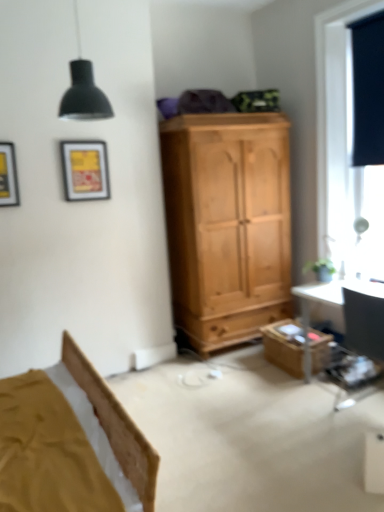
This screenshot has height=512, width=384. What are the coordinates of `matte yellow picture frame at upper left, which ranks as the second picture frame in back-to-front order` in the screenshot? It's located at (8, 176).

This screenshot has height=512, width=384. Describe the element at coordinates (8, 176) in the screenshot. I see `matte yellow picture frame at upper left, which is the first picture frame from front to back` at that location.

The image size is (384, 512). What do you see at coordinates (83, 89) in the screenshot?
I see `black matte lampshade at upper left` at bounding box center [83, 89].

Find the location of a particular element. black matte lampshade at upper left is located at coordinates (83, 89).

Describe the element at coordinates (284, 346) in the screenshot. The height and width of the screenshot is (512, 384). I see `wooden box at lower right` at that location.

Describe the element at coordinates (368, 90) in the screenshot. This screenshot has height=512, width=384. I see `black matte curtain at upper right` at that location.

Identify the location of matte yellow picture frame at upper left, which is counted as the first picture frame, starting from the left. The height and width of the screenshot is (512, 384). (8, 176).

This screenshot has height=512, width=384. Identify the location of curtain behind the matte yellow picture frame at upper left, which ranks as the second picture frame in back-to-front order. (368, 90).

Which of these two, black matte curtain at upper right or matte yellow picture frame at upper left, which is the first picture frame from front to back, is smaller?

matte yellow picture frame at upper left, which is the first picture frame from front to back, is smaller.

How many degrees apart are the facing directions of black matte curtain at upper right and matte yellow picture frame at upper left, which ranks as the second picture frame in back-to-front order?

The facing directions of black matte curtain at upper right and matte yellow picture frame at upper left, which ranks as the second picture frame in back-to-front order, are 94.1 degrees apart.

In the image, is black matte curtain at upper right on the left side or the right side of matte yellow picture frame at upper left, arranged as the second picture frame when viewed from the right?

In the image, black matte curtain at upper right appears on the right side of matte yellow picture frame at upper left, arranged as the second picture frame when viewed from the right.

Is wooden box at lower right outside of black matte lampshade at upper left?

Yes, wooden box at lower right is outside of black matte lampshade at upper left.

From the image's perspective, which is above, wooden box at lower right or black matte lampshade at upper left?

black matte lampshade at upper left is shown above in the image.

Could you tell me if wooden box at lower right is turned towards black matte lampshade at upper left?

No, wooden box at lower right is not turned towards black matte lampshade at upper left.

Is wooden box at lower right closer to camera compared to black matte lampshade at upper left?

No, it is behind black matte lampshade at upper left.

Can we say black matte curtain at upper right lies outside black fabric window at right?

That's incorrect, black matte curtain at upper right is not completely outside black fabric window at right.

Considering the relative positions of black matte curtain at upper right and black fabric window at right in the image provided, is black matte curtain at upper right to the left or to the right of black fabric window at right?

From the image, it's evident that black matte curtain at upper right is to the right of black fabric window at right.

Is black matte curtain at upper right aimed at black fabric window at right?

Yes, black matte curtain at upper right is oriented towards black fabric window at right.

From a real-world perspective, is black matte curtain at upper right over black fabric window at right?

Correct, in the physical world, black matte curtain at upper right is higher than black fabric window at right.

From a real-world perspective, between black fabric window at right and black matte lampshade at upper left, who is vertically higher?

black matte lampshade at upper left, from a real-world perspective.

You are a GUI agent. You are given a task and a screenshot of the screen. Output one action in this format:
    pyautogui.click(x=<x>, y=<y>)
    Task: Click on the light fixture above the black fabric window at right (from a real-world perspective)
    
    Given the screenshot: What is the action you would take?
    pyautogui.click(x=83, y=89)

Can you confirm if black fabric window at right is bigger than black matte lampshade at upper left?

Yes, black fabric window at right is bigger than black matte lampshade at upper left.

Can you confirm if matte yellow picture frame at upper left, which ranks as the second picture frame in back-to-front order, is positioned to the left of black matte curtain at upper right?

Yes.

From a real-world perspective, is matte yellow picture frame at upper left, which is counted as the first picture frame, starting from the left, positioned above or below black matte curtain at upper right?

matte yellow picture frame at upper left, which is counted as the first picture frame, starting from the left, is below black matte curtain at upper right.

Considering the relative sizes of matte yellow picture frame at upper left, which is counted as the first picture frame, starting from the left, and black matte curtain at upper right in the image provided, is matte yellow picture frame at upper left, which is counted as the first picture frame, starting from the left, smaller than black matte curtain at upper right?

Yes, matte yellow picture frame at upper left, which is counted as the first picture frame, starting from the left, is smaller than black matte curtain at upper right.

Between black matte curtain at upper right and black matte lampshade at upper left, which one has less height?

black matte lampshade at upper left.

Is black matte curtain at upper right next to black matte lampshade at upper left and touching it?

No, black matte curtain at upper right is not touching black matte lampshade at upper left.

Is black matte curtain at upper right in front of or behind black matte lampshade at upper left in the image?

black matte curtain at upper right is behind black matte lampshade at upper left.

Does point (364, 103) appear closer or farther from the camera than point (76, 65)?

Point (364, 103) is positioned farther from the camera compared to point (76, 65).

Is matte yellow picture frame at upper left, the 1th picture frame viewed from the back, located outside matte yellow picture frame at upper left, which is the first picture frame from front to back?

That's correct, matte yellow picture frame at upper left, the 1th picture frame viewed from the back, is outside of matte yellow picture frame at upper left, which is the first picture frame from front to back.

Between matte yellow picture frame at upper left, the second picture frame when ordered from left to right, and matte yellow picture frame at upper left, which is the first picture frame from front to back, which one has smaller width?

matte yellow picture frame at upper left, which is the first picture frame from front to back.

Considering their positions, is matte yellow picture frame at upper left, placed as the 1th picture frame when sorted from right to left, located in front of or behind matte yellow picture frame at upper left, arranged as the second picture frame when viewed from the right?

Clearly, matte yellow picture frame at upper left, placed as the 1th picture frame when sorted from right to left, is behind matte yellow picture frame at upper left, arranged as the second picture frame when viewed from the right.

The width and height of the screenshot is (384, 512). I want to click on picture frame behind the matte yellow picture frame at upper left, which is counted as the first picture frame, starting from the left, so click(x=85, y=170).

Where is `the 2nd picture frame to the left of the black matte curtain at upper right, starting your count from the anchor`? The image size is (384, 512). the 2nd picture frame to the left of the black matte curtain at upper right, starting your count from the anchor is located at coordinates (8, 176).

At what (x,y) coordinates should I click in order to perform the action: click on cabinetry that appears behind the black matte lampshade at upper left. Please return your answer as a coordinate pair (x, y). Looking at the image, I should click on (284, 346).

From the image, which object appears to be nearer to matte yellow picture frame at upper left, placed as the 1th picture frame when sorted from right to left, black fabric window at right or matte yellow picture frame at upper left, arranged as the second picture frame when viewed from the right?

matte yellow picture frame at upper left, arranged as the second picture frame when viewed from the right.

Looking at this image, from the image, which object appears to be farther from black matte lampshade at upper left, black fabric window at right or black matte curtain at upper right?

Among the two, black matte curtain at upper right is located further to black matte lampshade at upper left.

Estimate the real-world distances between objects in this image. Which object is closer to wooden box at lower right, black matte curtain at upper right or black fabric window at right?

black fabric window at right.

Estimate the real-world distances between objects in this image. Which object is further from black matte curtain at upper right, black fabric window at right or wooden box at lower right?

wooden box at lower right lies further to black matte curtain at upper right than the other object.

Considering their positions, is wooden box at lower right positioned further to black matte curtain at upper right than black matte lampshade at upper left?

black matte lampshade at upper left is further to black matte curtain at upper right.

Looking at the image, which one is located further to black matte curtain at upper right, black matte lampshade at upper left or matte yellow picture frame at upper left, which is counted as the first picture frame, starting from the left?

matte yellow picture frame at upper left, which is counted as the first picture frame, starting from the left, is positioned further to the anchor black matte curtain at upper right.

When comparing their distances from black matte lampshade at upper left, does matte yellow picture frame at upper left, which is counted as the first picture frame, starting from the left, or black fabric window at right seem closer?

Based on the image, matte yellow picture frame at upper left, which is counted as the first picture frame, starting from the left, appears to be nearer to black matte lampshade at upper left.

From the image, which object appears to be nearer to matte yellow picture frame at upper left, which is counted as the first picture frame, starting from the left, matte yellow picture frame at upper left, the second picture frame when ordered from left to right, or black matte curtain at upper right?

matte yellow picture frame at upper left, the second picture frame when ordered from left to right, is closer to matte yellow picture frame at upper left, which is counted as the first picture frame, starting from the left.

Identify the location of window between matte yellow picture frame at upper left, placed as the 1th picture frame when sorted from right to left, and black matte curtain at upper right. (331, 91).

This screenshot has width=384, height=512. I want to click on light fixture between matte yellow picture frame at upper left, the 1th picture frame viewed from the back, and black fabric window at right, in the horizontal direction, so click(x=83, y=89).

Find the location of a particular element. The image size is (384, 512). light fixture between black matte curtain at upper right and wooden box at lower right in the up-down direction is located at coordinates (83, 89).

Image resolution: width=384 pixels, height=512 pixels. Find the location of `picture frame between matte yellow picture frame at upper left, which ranks as the second picture frame in back-to-front order, and wooden box at lower right, in the horizontal direction`. picture frame between matte yellow picture frame at upper left, which ranks as the second picture frame in back-to-front order, and wooden box at lower right, in the horizontal direction is located at coordinates (85, 170).